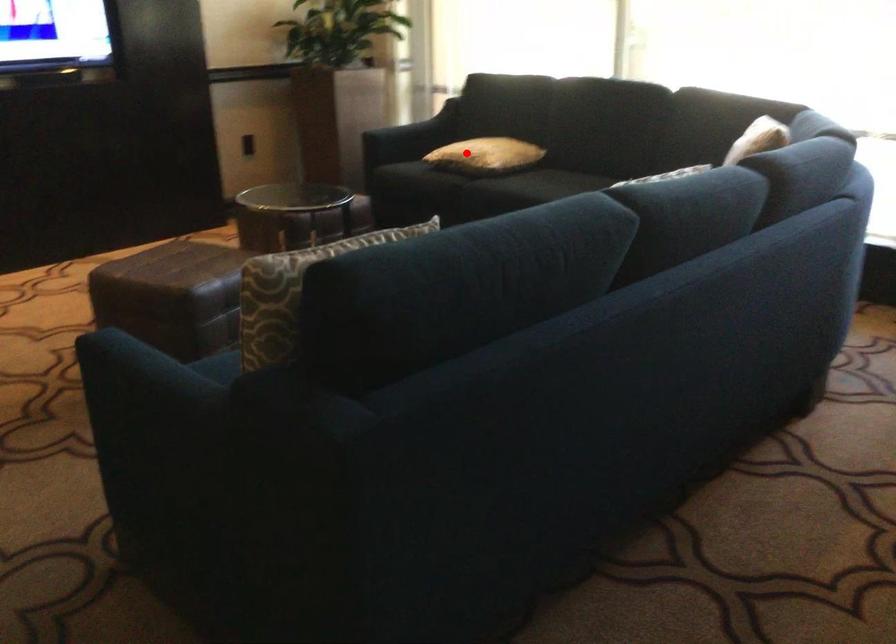
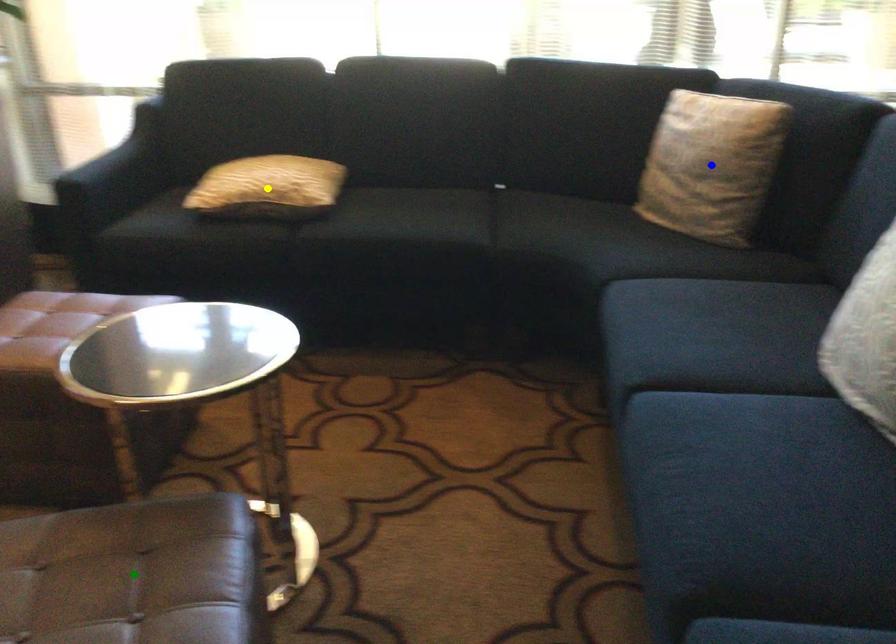
Question: I am providing you with two images of the same scene from different viewpoints. A red point is marked on the first image. You are given multiple points on the second image. Which mark in image 2 goes with the point in image 1?

Choices:
 (A) green point
 (B) yellow point
 (C) blue point

Answer: (B)